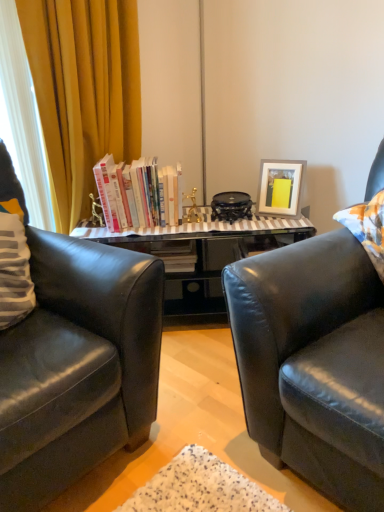
Question: From a real-world perspective, is black leather chair at left positioned over hardcover books at center based on gravity?

Choices:
 (A) no
 (B) yes

Answer: (A)

Question: Is black leather chair at left far away from hardcover books at center?

Choices:
 (A) yes
 (B) no

Answer: (B)

Question: Is black leather chair at left smaller than hardcover books at center?

Choices:
 (A) no
 (B) yes

Answer: (A)

Question: From a real-world perspective, is black leather chair at left under hardcover books at center?

Choices:
 (A) yes
 (B) no

Answer: (A)

Question: Would you say hardcover books at center is part of black leather chair at left's contents?

Choices:
 (A) no
 (B) yes

Answer: (A)

Question: Is point (177, 202) positioned closer to the camera than point (71, 93)?

Choices:
 (A) farther
 (B) closer

Answer: (A)

Question: From the image's perspective, relative to yellow fabric curtain at left, is hardcover books at center above or below?

Choices:
 (A) below
 (B) above

Answer: (A)

Question: Looking at the image, does hardcover books at center seem bigger or smaller compared to yellow fabric curtain at left?

Choices:
 (A) small
 (B) big

Answer: (A)

Question: Is hardcover books at center in front of or behind yellow fabric curtain at left in the image?

Choices:
 (A) behind
 (B) front

Answer: (A)

Question: Is point 100,180 positioned closer to the camera than point 284,203?

Choices:
 (A) closer
 (B) farther

Answer: (A)

Question: Is hardcover books at center in front of or behind matte gray picture frame at upper right in the image?

Choices:
 (A) front
 (B) behind

Answer: (A)

Question: From the image's perspective, is hardcover books at center above or below matte gray picture frame at upper right?

Choices:
 (A) below
 (B) above

Answer: (B)

Question: Considering the positions of hardcover books at center and matte gray picture frame at upper right in the image, is hardcover books at center taller or shorter than matte gray picture frame at upper right?

Choices:
 (A) short
 (B) tall

Answer: (B)

Question: From a real-world perspective, is yellow fabric curtain at left positioned above or below black leather chair at left?

Choices:
 (A) below
 (B) above

Answer: (B)

Question: Is yellow fabric curtain at left bigger or smaller than black leather chair at left?

Choices:
 (A) small
 (B) big

Answer: (A)